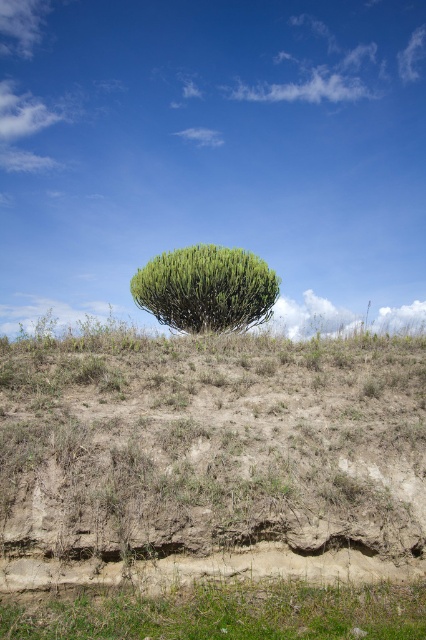
You are standing on the green grassy at lower center and want to walk towards the green grassy hillside at center. In which direction should you head?

You should head to the right because the green grassy hillside at center is located to the left of green grassy at lower center, meaning the hillside is on your left side when facing the direction of movement. To reach it, you need to turn towards your left and walk in that direction.

You are standing on the green grassy at lower center and want to reach the green grassy hillside at center. Which direction should you move to ascend the slope?

To ascend the slope from the green grassy at lower center to the green grassy hillside at center, you should move upward since the green grassy hillside at center is positioned over the green grassy at lower center.